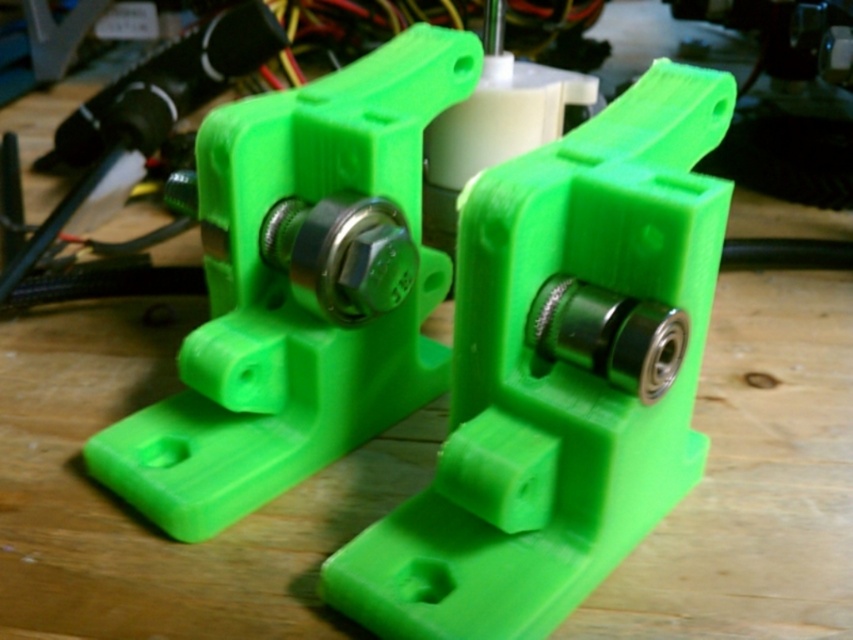
Which of these two, green matte plastic at center or green matte plastic object at center, stands taller?

Standing taller between the two is green matte plastic object at center.

Does green matte plastic at center appear on the right side of green matte plastic object at center?

Correct, you'll find green matte plastic at center to the right of green matte plastic object at center.

This screenshot has width=853, height=640. What do you see at coordinates (556, 376) in the screenshot?
I see `green matte plastic at center` at bounding box center [556, 376].

You are a GUI agent. You are given a task and a screenshot of the screen. Output one action in this format:
    pyautogui.click(x=<x>, y=<y>)
    Task: Click on the green matte plastic at center
    The width and height of the screenshot is (853, 640).
    Given the screenshot: What is the action you would take?
    pyautogui.click(x=556, y=376)